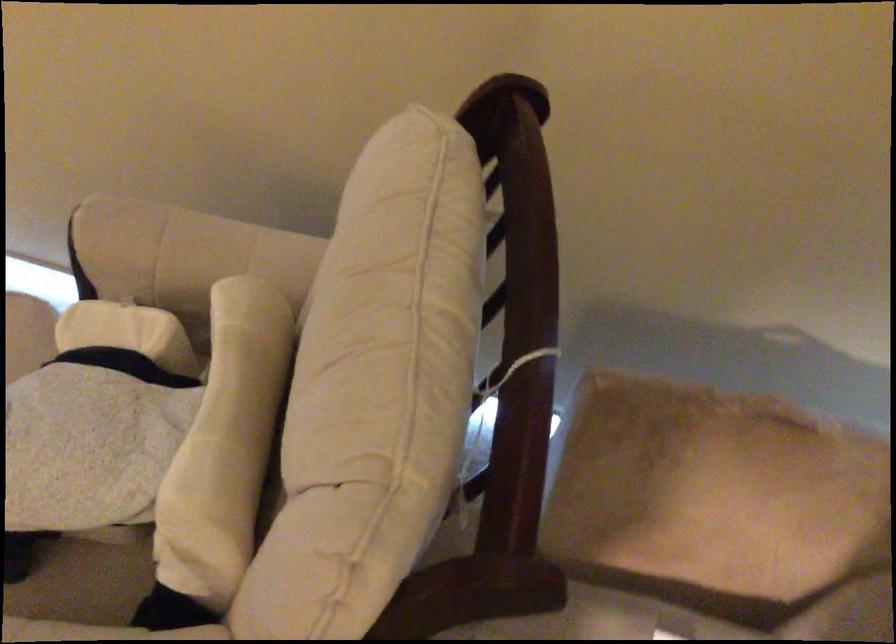
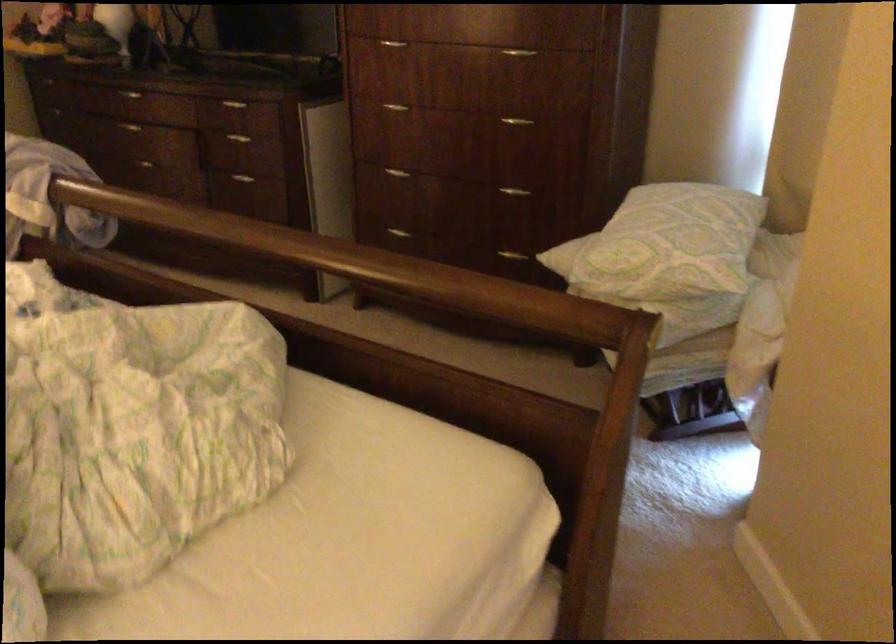
Question: The images are taken continuously from a first-person perspective. In which direction is your viewpoint rotating?

Choices:
 (A) Left
 (B) Right
 (C) Up
 (D) Down

Answer: (A)